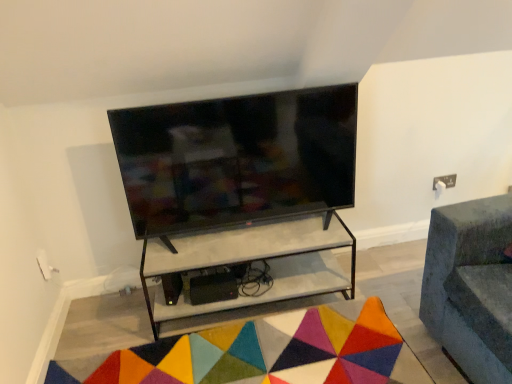
Question: Does multicolored felt mat at lower center contain white marble shelf at center?

Choices:
 (A) no
 (B) yes

Answer: (A)

Question: From a real-world perspective, does multicolored felt mat at lower center stand above white marble shelf at center?

Choices:
 (A) yes
 (B) no

Answer: (B)

Question: From the image's perspective, is multicolored felt mat at lower center located beneath white marble shelf at center?

Choices:
 (A) yes
 (B) no

Answer: (A)

Question: Is multicolored felt mat at lower center facing away from white marble shelf at center?

Choices:
 (A) no
 (B) yes

Answer: (B)

Question: Are multicolored felt mat at lower center and white marble shelf at center making contact?

Choices:
 (A) no
 (B) yes

Answer: (A)

Question: Visually, is matte black tv at center positioned to the left or to the right of white marble shelf at center?

Choices:
 (A) right
 (B) left

Answer: (B)

Question: Considering the positions of point (269, 157) and point (227, 249), is point (269, 157) closer or farther from the camera than point (227, 249)?

Choices:
 (A) farther
 (B) closer

Answer: (B)

Question: In terms of height, does matte black tv at center look taller or shorter compared to white marble shelf at center?

Choices:
 (A) tall
 (B) short

Answer: (A)

Question: Based on their sizes in the image, would you say matte black tv at center is bigger or smaller than white marble shelf at center?

Choices:
 (A) big
 (B) small

Answer: (B)

Question: Based on their sizes in the image, would you say multicolored felt mat at lower center is bigger or smaller than white marble shelf at center?

Choices:
 (A) big
 (B) small

Answer: (B)

Question: Does point (347, 382) appear closer or farther from the camera than point (324, 248)?

Choices:
 (A) closer
 (B) farther

Answer: (A)

Question: Considering the positions of multicolored felt mat at lower center and white marble shelf at center in the image, is multicolored felt mat at lower center taller or shorter than white marble shelf at center?

Choices:
 (A) short
 (B) tall

Answer: (A)

Question: Relative to white marble shelf at center, is multicolored felt mat at lower center in front or behind?

Choices:
 (A) front
 (B) behind

Answer: (A)

Question: Relative to multicolored felt mat at lower center, is matte black tv at center in front or behind?

Choices:
 (A) behind
 (B) front

Answer: (A)

Question: From the image's perspective, relative to multicolored felt mat at lower center, is matte black tv at center above or below?

Choices:
 (A) below
 (B) above

Answer: (B)